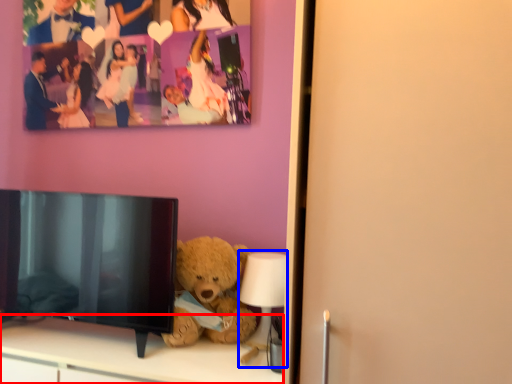
Question: Which point is further to the camera, furniture (highlighted by a red box) or lamp (highlighted by a blue box)?

Choices:
 (A) furniture
 (B) lamp

Answer: (B)